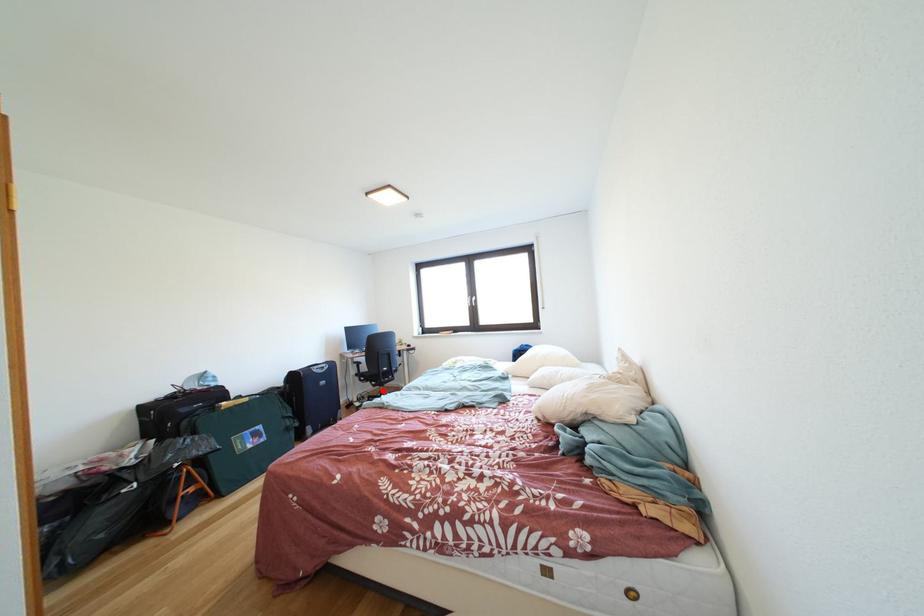
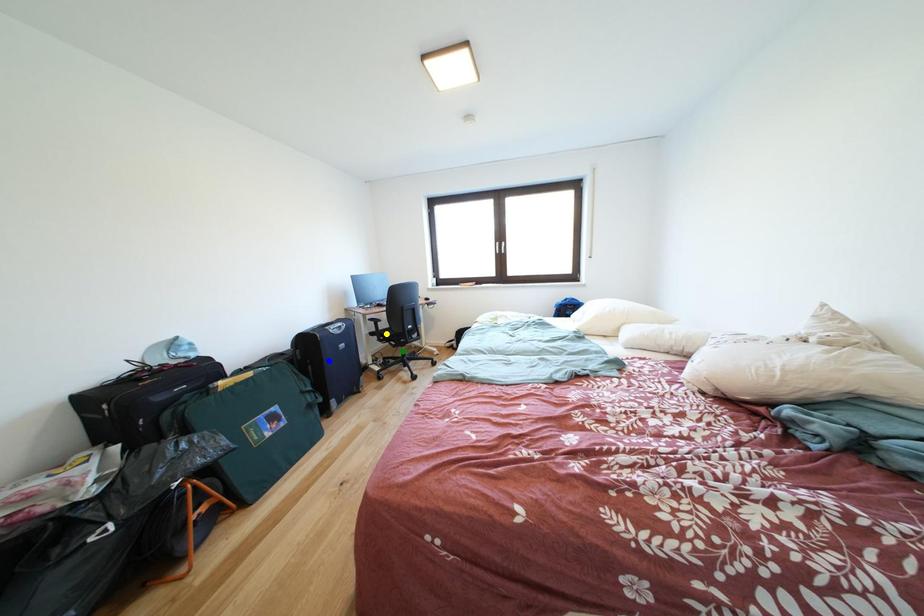
Question: I am providing you with two images of the same scene from different viewpoints. A red point is marked on the first image. You are given multiple points on the second image. Which mark in image 2 goes with the point in image 1?

Choices:
 (A) green point
 (B) blue point
 (C) yellow point

Answer: (A)